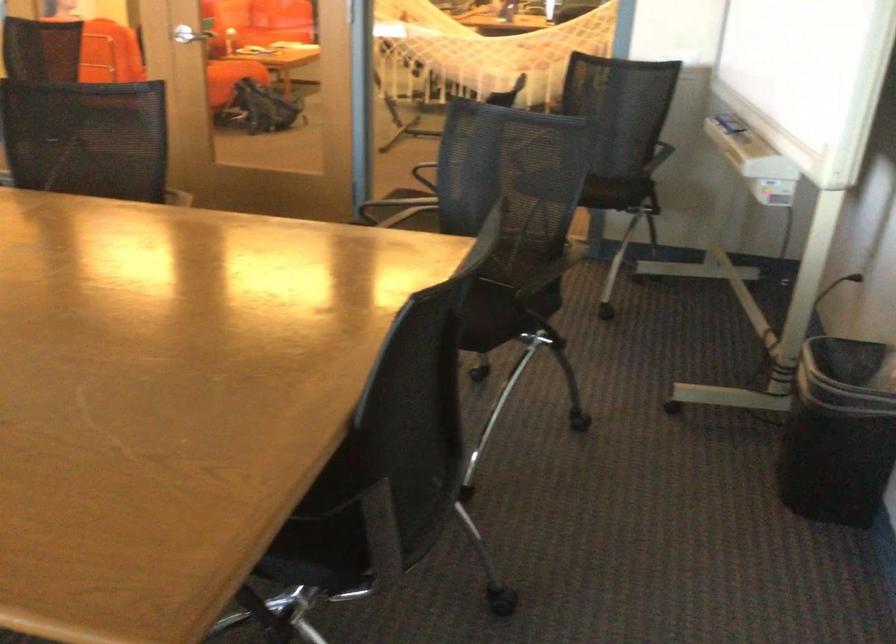
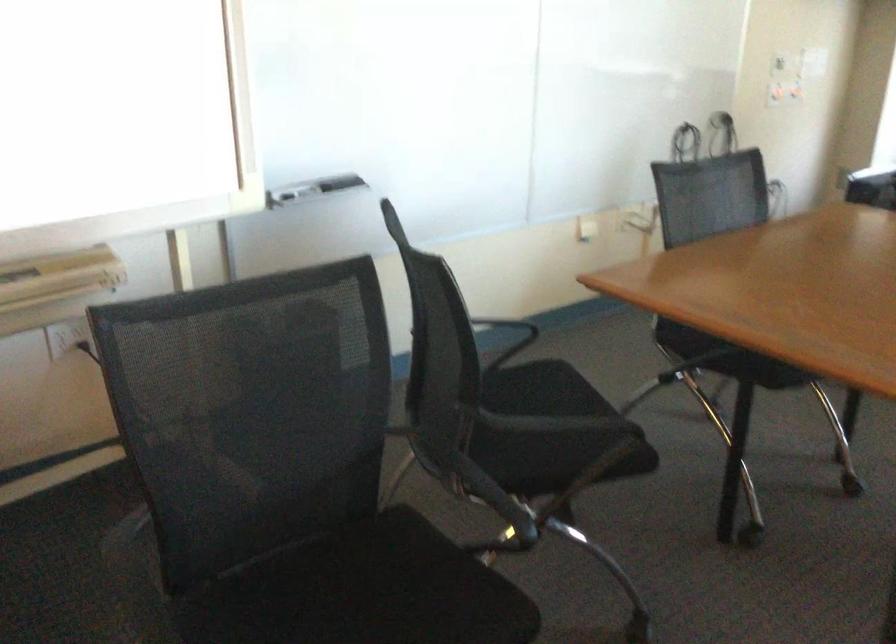
In the second image, find the point that corresponds to (x=424, y=223) in the first image.

(363, 592)